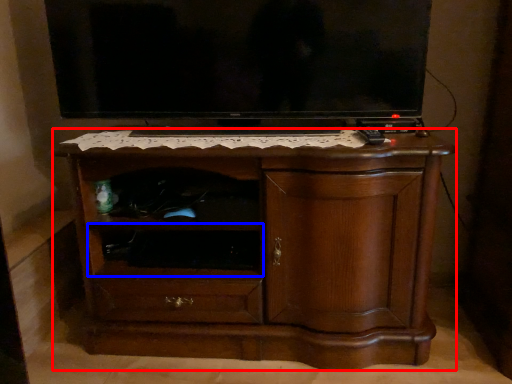
Question: Among these objects, which one is nearest to the camera, chest of drawers (highlighted by a red box) or shelf (highlighted by a blue box)?

Choices:
 (A) chest of drawers
 (B) shelf

Answer: (A)